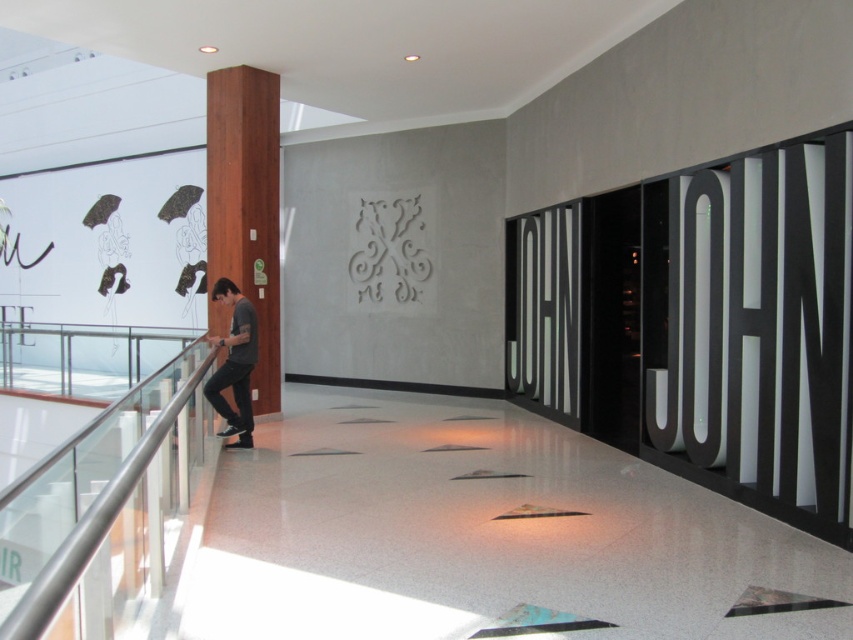
You are a customer entering the space and want to know which object is bigger between the silver metallic railing at left and the wooden pillar at left. Can you tell me?

The silver metallic railing at left is larger in size than the wooden pillar at left.

You are a delivery person carrying a box that is 1.2 meters wide. You need to navigate through the space between the silver metallic railing at left and yourself. Can you pass through this space without tilting the box sideways?

The space between the silver metallic railing at left and the viewer is only 1.11 meters, which is narrower than the 1.2 meter wide box. Therefore, you cannot pass through without tilting the box sideways.